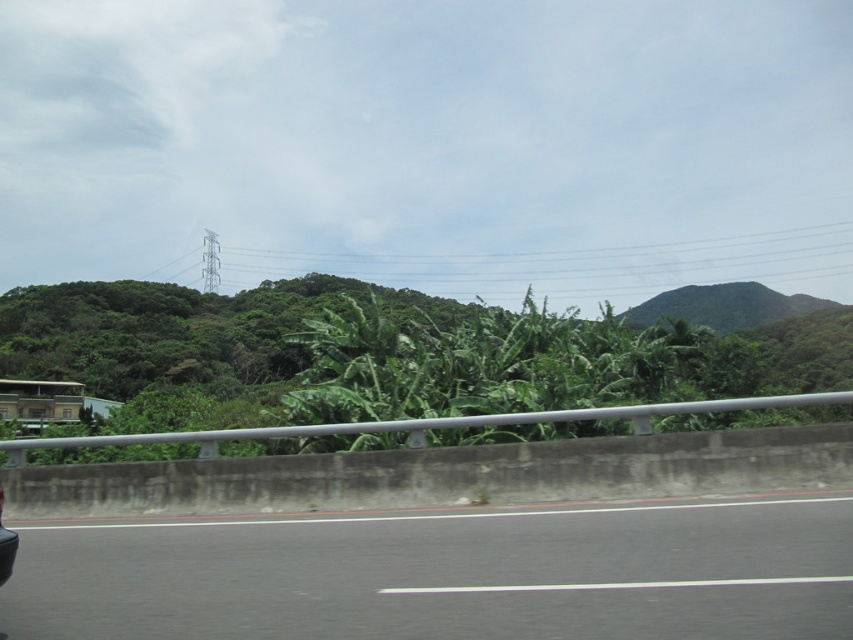
Between green leafy vegetation at center and metallic gray power line at upper center, which one has less height?

Standing shorter between the two is green leafy vegetation at center.

Locate an element on the screen. The height and width of the screenshot is (640, 853). green leafy vegetation at center is located at coordinates (386, 355).

Locate an element on the screen. The height and width of the screenshot is (640, 853). green leafy vegetation at center is located at coordinates (386, 355).

Which is more to the right, metallic gray power line at upper center or shiny black car at lower left?

metallic gray power line at upper center is more to the right.

Is metallic gray power line at upper center closer to camera compared to shiny black car at lower left?

No, it is not.

Is point (641, 289) more distant than point (9, 573)?

Yes, point (641, 289) is farther from viewer.

What are the coordinates of `metallic gray power line at upper center` in the screenshot? It's located at pos(576,262).

Between black asphalt highway at lower left and green leafy vegetation at center, which one appears on the right side from the viewer's perspective?

green leafy vegetation at center is more to the right.

Between point (79, 570) and point (112, 284), which one is positioned behind?

The point (112, 284) is more distant.

Who is more forward, [374,518] or [230,422]?

Point [374,518] is in front.

Find the location of a particular element. This screenshot has height=640, width=853. black asphalt highway at lower left is located at coordinates (445, 573).